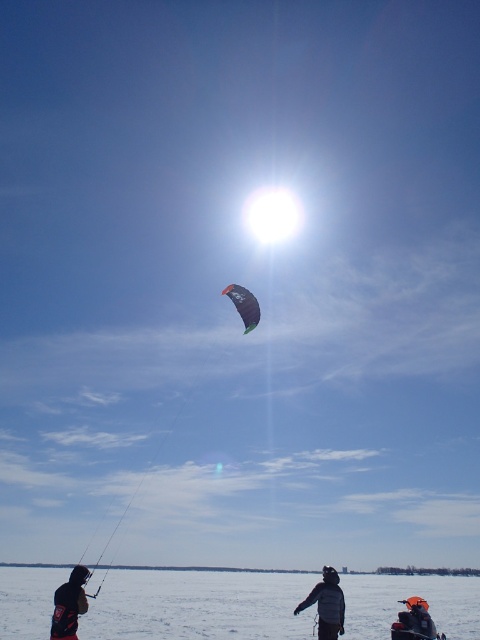
You are planning to place a 1.2 meter wide picnic blanket on the white snow at lower center. Considering the width of the dark gray jacket at lower left, will there be enough space for the blanket without overlapping the jacket?

The white snow at lower center is wider than the dark gray jacket at lower left, so there should be enough space to place the 1.2 meter wide picnic blanket on the white snow at lower center without overlapping the jacket.